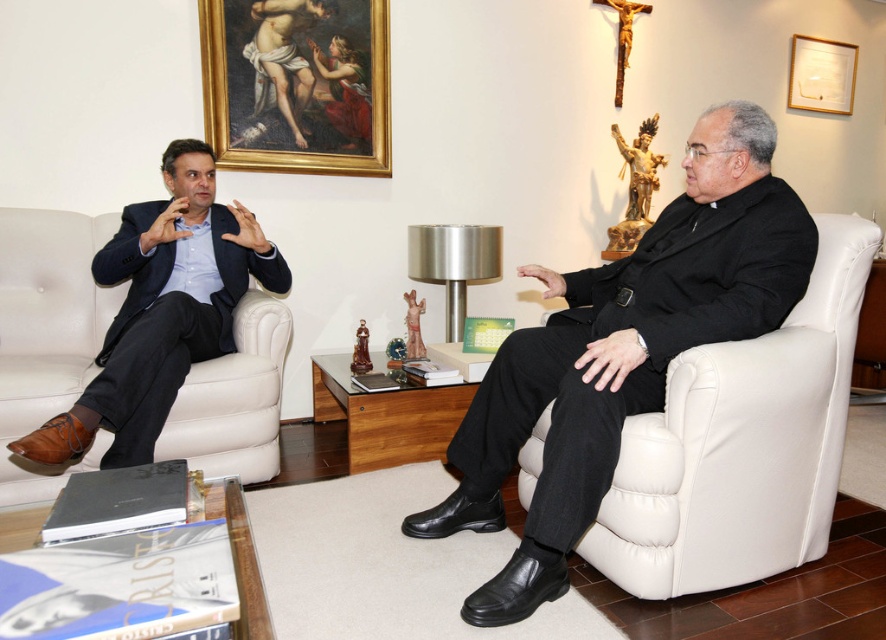
Question: Which point appears closest to the camera in this image?

Choices:
 (A) (574, 381)
 (B) (813, 104)
 (C) (701, 442)

Answer: (C)

Question: Is white leather armchair at right to the right of gold-framed painting at upper center from the viewer's perspective?

Choices:
 (A) yes
 (B) no

Answer: (A)

Question: Which point is closer to the camera taking this photo?

Choices:
 (A) (807, 403)
 (B) (358, 138)

Answer: (A)

Question: Is gold-framed painting at upper center smaller than wooden picture frame at upper right?

Choices:
 (A) yes
 (B) no

Answer: (B)

Question: Is white leather armchair at right further to camera compared to gold-framed painting at upper center?

Choices:
 (A) yes
 (B) no

Answer: (B)

Question: Considering the real-world distances, which object is closest to the white leather armchair at right?

Choices:
 (A) gold-framed painting at upper center
 (B) brown leather shoes at left
 (C) wooden picture frame at upper right

Answer: (B)